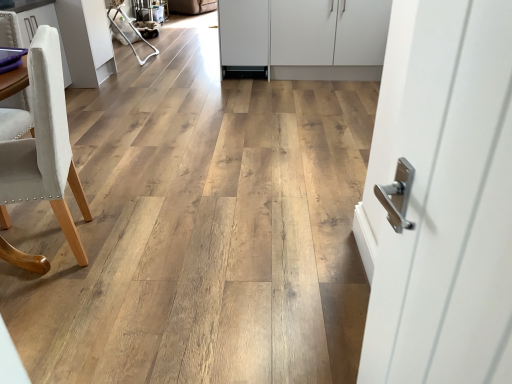
This screenshot has width=512, height=384. Find the location of `vacant space behind light beige fabric chair at left`. vacant space behind light beige fabric chair at left is located at coordinates (118, 183).